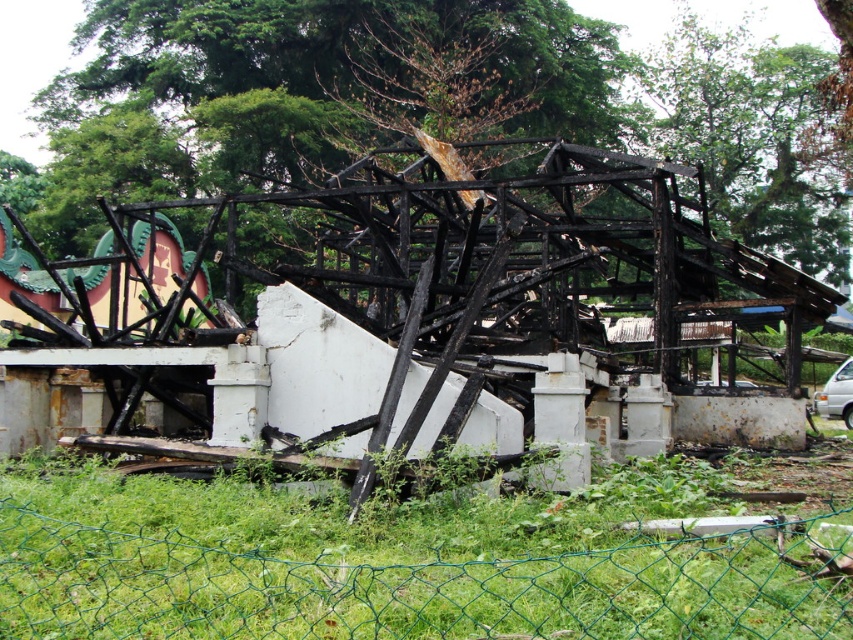
Question: Which object is closer to the camera taking this photo?

Choices:
 (A) brown wood tree at upper center
 (B) green wire mesh fence at lower center

Answer: (B)

Question: Is brown wood tree at upper center wider than green wire mesh fence at lower center?

Choices:
 (A) yes
 (B) no

Answer: (A)

Question: Among these objects, which one is nearest to the camera?

Choices:
 (A) green wire mesh fence at lower center
 (B) brown wood tree at upper center

Answer: (A)

Question: Is brown wood tree at upper center thinner than green wire mesh fence at lower center?

Choices:
 (A) no
 (B) yes

Answer: (A)

Question: Does brown wood tree at upper center come in front of green wire mesh fence at lower center?

Choices:
 (A) no
 (B) yes

Answer: (A)